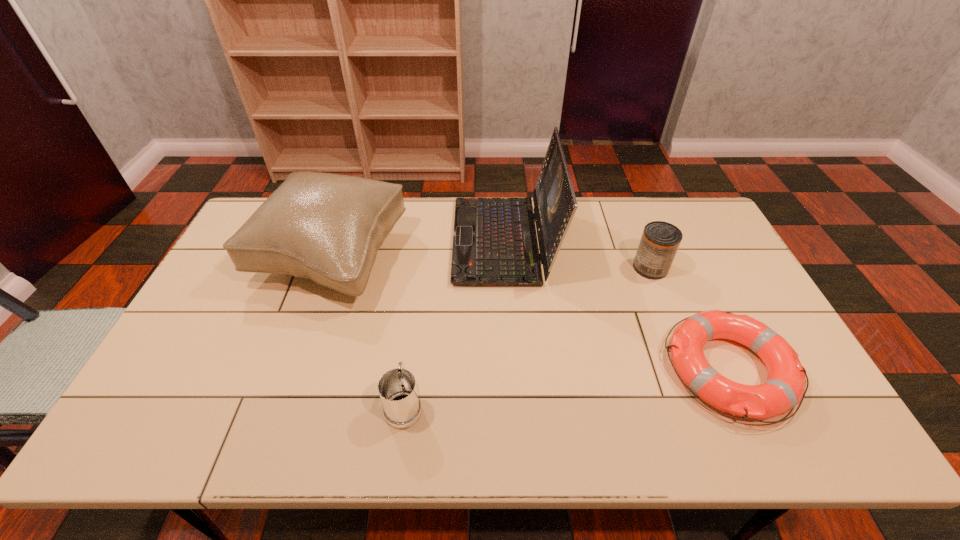
At what (x,y) coordinates should I click in order to perform the action: click on object that is at the left edge. Please return your answer as a coordinate pair (x, y). This screenshot has height=540, width=960. Looking at the image, I should click on (326, 227).

The height and width of the screenshot is (540, 960). Find the location of `object located at the right edge`. object located at the right edge is located at coordinates tap(784, 388).

At what (x,y) coordinates should I click in order to perform the action: click on object that is at the far left corner. Please return your answer as a coordinate pair (x, y). The width and height of the screenshot is (960, 540). Looking at the image, I should click on (326, 227).

In order to click on object that is at the near right corner in this screenshot , I will do `click(784, 388)`.

Identify the location of vacant area at the far edge. (658, 212).

Locate an element on the screen. The height and width of the screenshot is (540, 960). vacant position at the near edge of the desktop is located at coordinates (348, 431).

The height and width of the screenshot is (540, 960). I want to click on free space at the left edge, so click(x=238, y=335).

Identify the location of free space at the far right corner of the desktop. This screenshot has width=960, height=540. (699, 232).

Identify the location of free space between the third object from right to left and the fourth shortest object. The height and width of the screenshot is (540, 960). (418, 249).

Where is `free space between the life buoy and the leftmost object`? free space between the life buoy and the leftmost object is located at coordinates (530, 314).